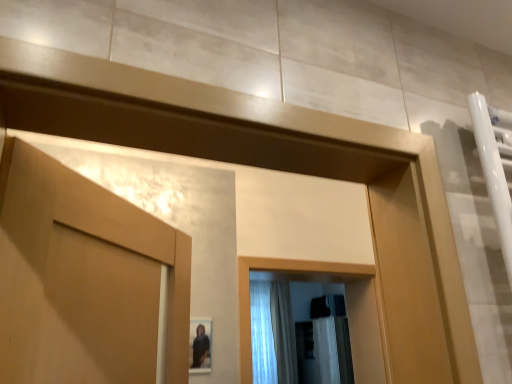
Question: From a real-world perspective, is white sheer fabric at center, acting as the second shower curtain starting from the left, physically above white sheer fabric at center, the 2th shower curtain in the right-to-left sequence?

Choices:
 (A) yes
 (B) no

Answer: (B)

Question: Is white sheer fabric at center, acting as the second shower curtain starting from the left, oriented towards white sheer fabric at center, the 2th shower curtain in the right-to-left sequence?

Choices:
 (A) no
 (B) yes

Answer: (A)

Question: Considering the relative positions of white sheer fabric at center, which is counted as the first shower curtain, starting from the right, and white sheer fabric at center, the 2th shower curtain in the right-to-left sequence, in the image provided, is white sheer fabric at center, which is counted as the first shower curtain, starting from the right, to the left of white sheer fabric at center, the 2th shower curtain in the right-to-left sequence, from the viewer's perspective?

Choices:
 (A) yes
 (B) no

Answer: (B)

Question: Is white sheer fabric at center, acting as the second shower curtain starting from the left, looking in the opposite direction of white sheer fabric at center, the 2th shower curtain in the right-to-left sequence?

Choices:
 (A) yes
 (B) no

Answer: (B)

Question: Would you say white sheer fabric at center, acting as the second shower curtain starting from the left, is a long distance from white sheer fabric at center, the 2th shower curtain in the right-to-left sequence?

Choices:
 (A) yes
 (B) no

Answer: (B)

Question: Is white sheer fabric at center, acting as the second shower curtain starting from the left, wider than white sheer fabric at center, positioned as the first shower curtain in left-to-right order?

Choices:
 (A) no
 (B) yes

Answer: (B)

Question: Is white sheer fabric at center, positioned as the first shower curtain in left-to-right order, thinner than white sheer fabric at center, which is counted as the first shower curtain, starting from the right?

Choices:
 (A) yes
 (B) no

Answer: (A)

Question: From a real-world perspective, is white sheer fabric at center, positioned as the first shower curtain in left-to-right order, positioned under white sheer fabric at center, acting as the second shower curtain starting from the left, based on gravity?

Choices:
 (A) no
 (B) yes

Answer: (A)

Question: Does white sheer fabric at center, the 2th shower curtain in the right-to-left sequence, contain white sheer fabric at center, acting as the second shower curtain starting from the left?

Choices:
 (A) yes
 (B) no

Answer: (B)

Question: Is white sheer fabric at center, positioned as the first shower curtain in left-to-right order, facing towards white sheer fabric at center, which is counted as the first shower curtain, starting from the right?

Choices:
 (A) no
 (B) yes

Answer: (A)

Question: Considering the relative positions of white sheer fabric at center, positioned as the first shower curtain in left-to-right order, and white sheer fabric at center, which is counted as the first shower curtain, starting from the right, in the image provided, is white sheer fabric at center, positioned as the first shower curtain in left-to-right order, to the left of white sheer fabric at center, which is counted as the first shower curtain, starting from the right, from the viewer's perspective?

Choices:
 (A) no
 (B) yes

Answer: (B)

Question: Is white sheer fabric at center, positioned as the first shower curtain in left-to-right order, touching white sheer fabric at center, which is counted as the first shower curtain, starting from the right?

Choices:
 (A) yes
 (B) no

Answer: (B)

Question: Is point (294, 365) closer or farther from the camera than point (252, 327)?

Choices:
 (A) closer
 (B) farther

Answer: (B)